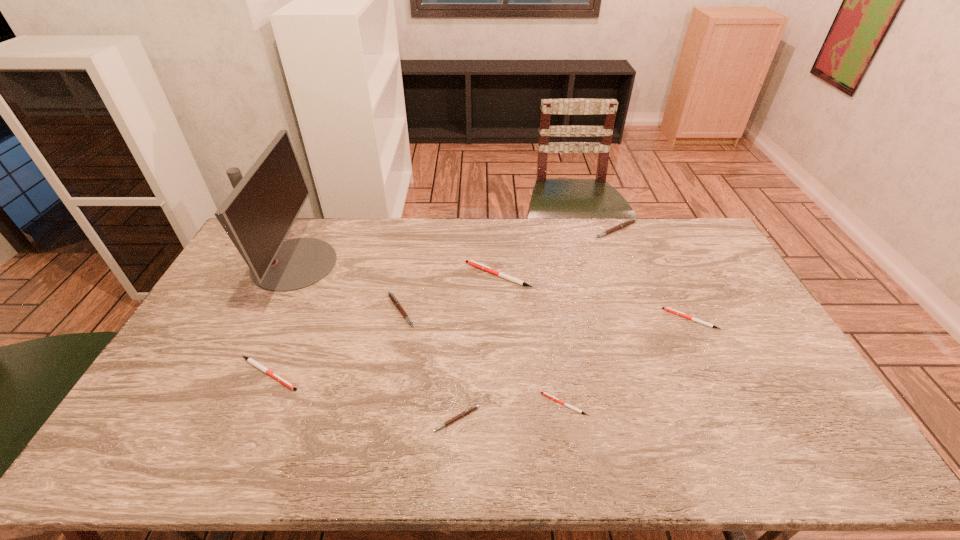
Locate an element on the screen. The image size is (960, 540). pen located at the far edge is located at coordinates (631, 221).

In order to click on object located at the left edge in this screenshot , I will do `click(258, 214)`.

You are a GUI agent. You are given a task and a screenshot of the screen. Output one action in this format:
    pyautogui.click(x=<x>, y=<y>)
    Task: Click on the object located in the right edge section of the desktop
    The height and width of the screenshot is (540, 960).
    Given the screenshot: What is the action you would take?
    pyautogui.click(x=667, y=309)

Find the location of `object that is at the far left corner`. object that is at the far left corner is located at coordinates (258, 214).

The width and height of the screenshot is (960, 540). In the image, there is a desktop. Find the location of `vacant region at the far edge`. vacant region at the far edge is located at coordinates tap(664, 249).

Image resolution: width=960 pixels, height=540 pixels. In the image, there is a desktop. Identify the location of vacant space at the near edge. (262, 438).

In the image, there is a desktop. Where is `vacant space at the left edge`? vacant space at the left edge is located at coordinates (208, 364).

This screenshot has height=540, width=960. In order to click on free space at the right edge of the desktop in this screenshot , I will do `click(749, 383)`.

The width and height of the screenshot is (960, 540). I want to click on free space at the near right corner of the desktop, so (810, 453).

Where is `free space between the biggest white pen and the shortest pen`? free space between the biggest white pen and the shortest pen is located at coordinates (531, 340).